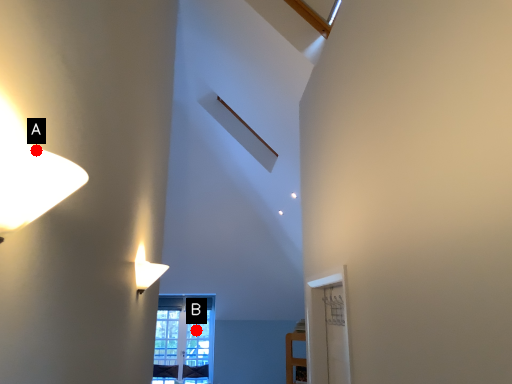
Question: Two points are circled on the image, labeled by A and B beside each circle. Which point is closer to the camera?

Choices:
 (A) A is closer
 (B) B is closer

Answer: (A)